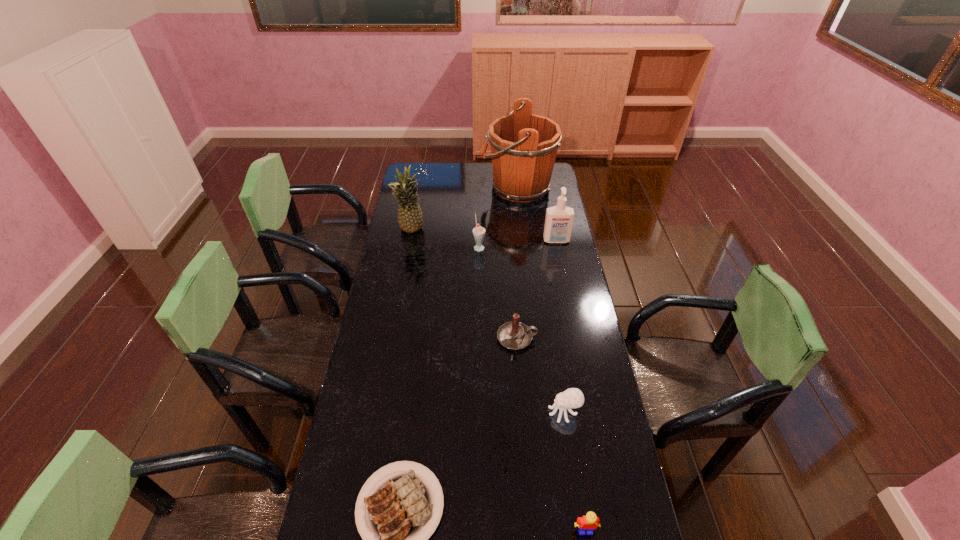
The image size is (960, 540). What are the coordinates of `the tallest object` in the screenshot? It's located at (524, 146).

Identify the location of bucket. (524, 146).

Find the location of a particular element. pineapple is located at coordinates (410, 216).

The image size is (960, 540). Find the location of `cleansing agent`. cleansing agent is located at coordinates (559, 219).

You are a GUI agent. You are given a task and a screenshot of the screen. Output one action in this format:
    pyautogui.click(x=<x>, y=<y>)
    Task: Click on the milkshake
    The width and height of the screenshot is (960, 540).
    Given the screenshot: What is the action you would take?
    pyautogui.click(x=478, y=232)

What are the coordinates of `candle` in the screenshot? It's located at (514, 335).

The width and height of the screenshot is (960, 540). I want to click on octopus, so click(573, 397).

Where is `Lego`? Lego is located at coordinates (589, 522).

In order to click on vacant region located 0.250m with the handle on the side of the bucket in this screenshot , I will do `click(435, 187)`.

The height and width of the screenshot is (540, 960). What are the coordinates of `vacant space situated 0.360m with the handle on the side of the bucket` in the screenshot? It's located at (415, 187).